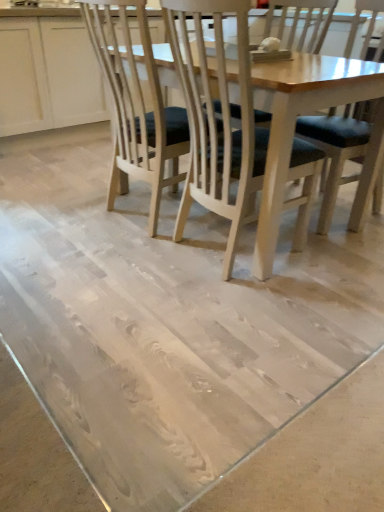
Question: From a real-world perspective, relative to white wood cabinet at upper left, is wooden chair with dark cushion at center, the 2th chair when ordered from right to left, vertically above or below?

Choices:
 (A) above
 (B) below

Answer: (A)

Question: Looking at the image, does wooden chair with dark cushion at center, which appears as the first chair when viewed from the left, seem bigger or smaller compared to white wood cabinet at upper left?

Choices:
 (A) big
 (B) small

Answer: (B)

Question: Estimate the real-world distances between objects in this image. Which object is farther from the dark blue fabric chair at center, which is the 1th chair in right-to-left order?

Choices:
 (A) wooden chair with dark cushion at center, which appears as the first chair when viewed from the left
 (B) white wood cabinet at upper left

Answer: (B)

Question: Estimate the real-world distances between objects in this image. Which object is farther from the wooden chair with dark cushion at center, which appears as the first chair when viewed from the left?

Choices:
 (A) dark blue fabric chair at center, placed as the second chair when sorted from left to right
 (B) white wood cabinet at upper left

Answer: (B)